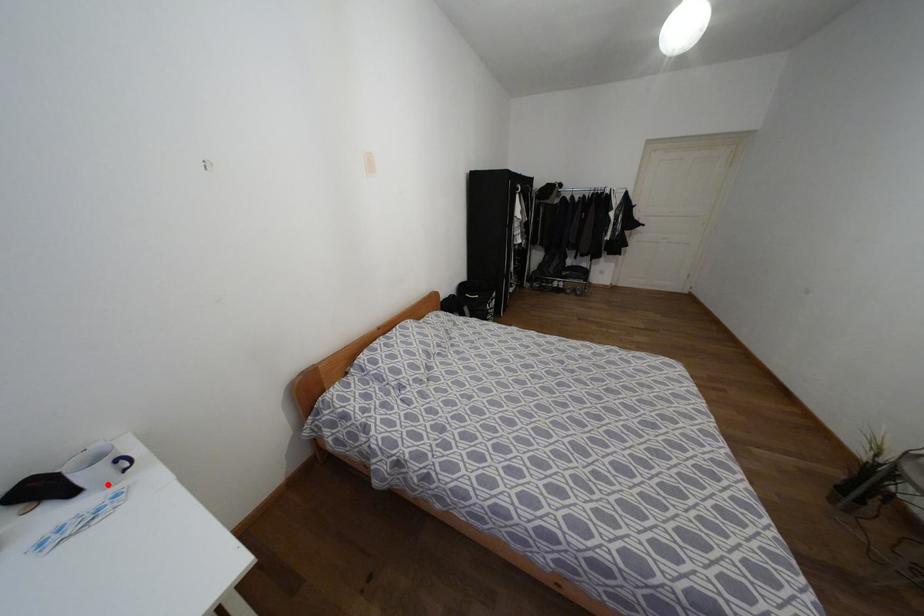
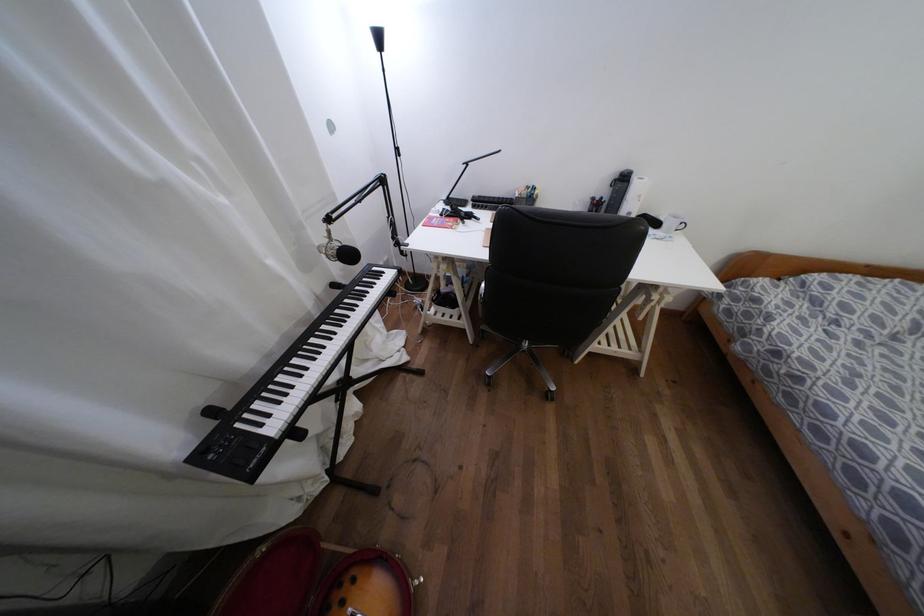
The point at the highlighted location is marked in the first image. Where is the corresponding point in the second image?

(666, 232)